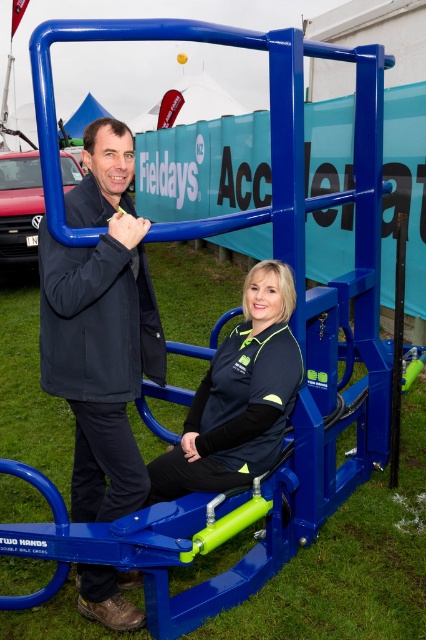
From the picture: You are a photographer setting up for a photo shoot. You have a camera with a 10 inch focus range. You need to capture both the matte blue exercise machine at center and the black fabric jacket at center in focus. Can you do this with your current camera settings?

The matte blue exercise machine at center and the black fabric jacket at center are 10.85 inches apart. Since your camera has a 10 inch focus range, it cannot capture both objects in focus simultaneously. You will need to adjust your camera settings or move closer to ensure both are within the focus range.

You are a photographer trying to capture a closeup of the matte black jacket at center. Given that the camera lens has a focal length of 50mm and the jacket is at coordinates point 0.512, 0.237, can you determine if the jacket is within the camera frame?

The matte black jacket at center is located at point (100, 326), which falls within the standard camera frame coordinates. Therefore, the jacket is within the camera frame and can be captured in the closeup.

You are standing at the origin point in the image. The blue exercise machine is marked at point [100,326]. If you want to walk directly to the machine, which direction should you head?

The point [100,326] indicates the location of the matte blue exercise machine at center. Since you are at the origin, you should move towards the coordinates [100,326], which would be to the right and slightly downward from your current position.